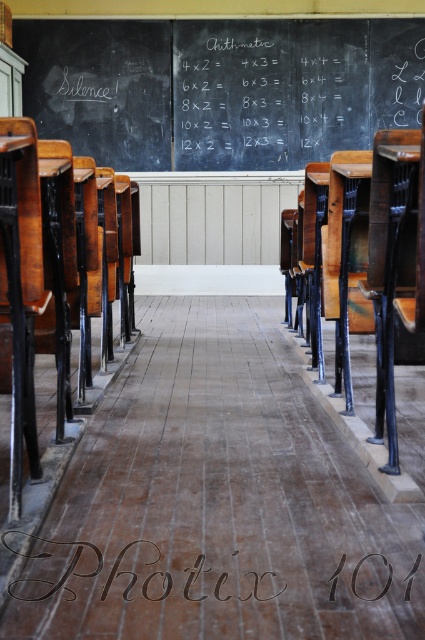
The image size is (425, 640). In order to click on black chalkboard at upper center in this screenshot , I will do `click(220, 88)`.